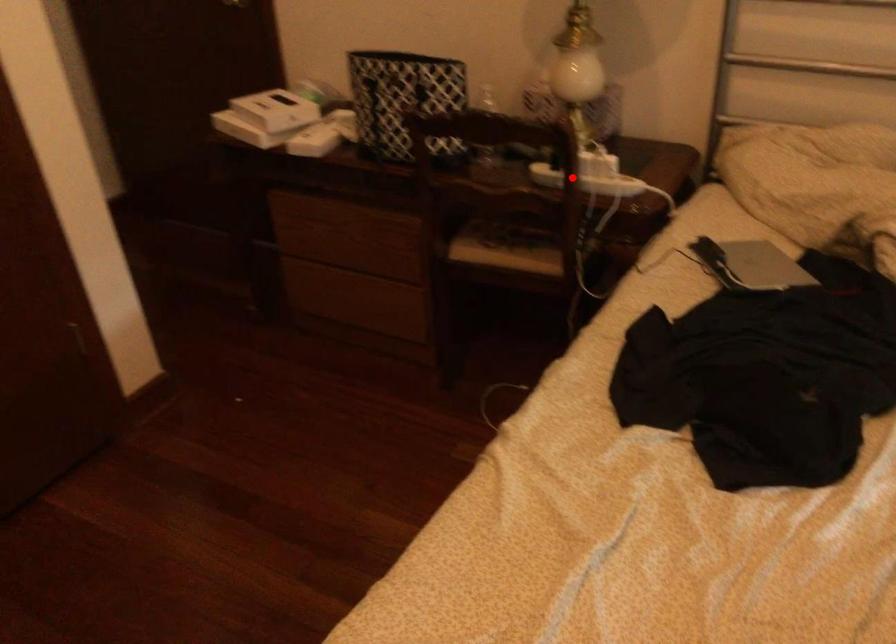
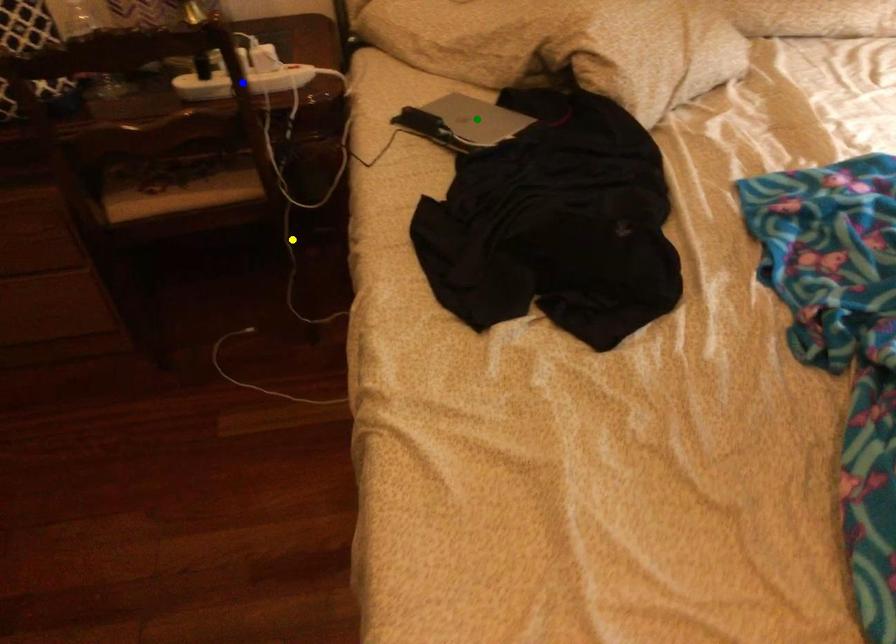
Question: I am providing you with two images of the same scene from different viewpoints. A red point is marked on the first image. You are given multiple points on the second image. Which mark in image 2 goes with the point in image 1?

Choices:
 (A) blue point
 (B) yellow point
 (C) green point

Answer: (A)